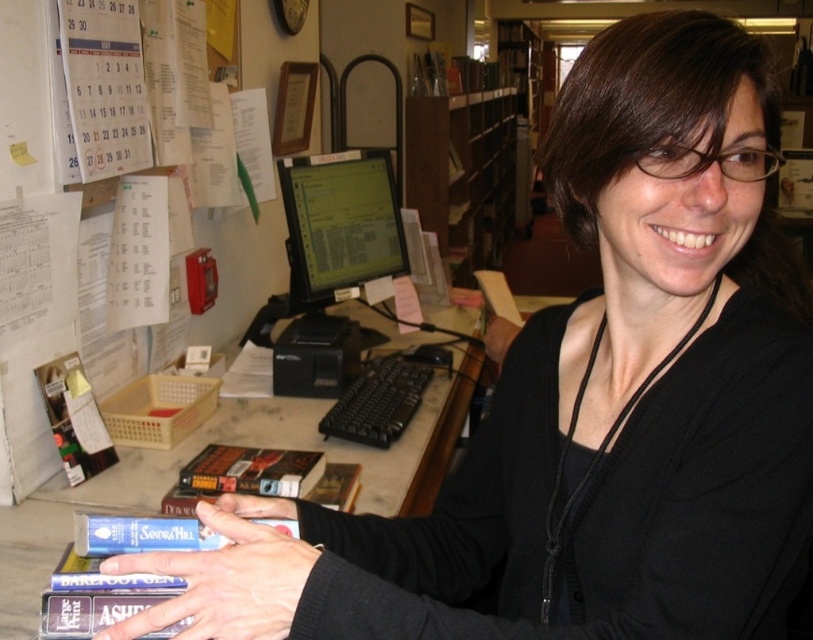
You are a visitor at the library and need to place a large book on the desk. Considering the height difference between the marble desk at center and the green matte computer monitor at center, will the book fit on the desk without touching the monitor?

The marble desk at center is not as tall as the green matte computer monitor at center, so the book may not fit on the desk without touching the monitor if the desk is shorter. However, since the exact height difference isn not specified, it depends on how much space is between them.

You are a visitor in this library and you need to place a book on the wooden bookshelf at upper center. The book is currently in the matte black hand at center. Which direction should you move the hand to reach the bookshelf?

The wooden bookshelf at upper center is to the right of the matte black hand at center, so you should move the matte black hand at center to the right to place the book on the wooden bookshelf at upper center.